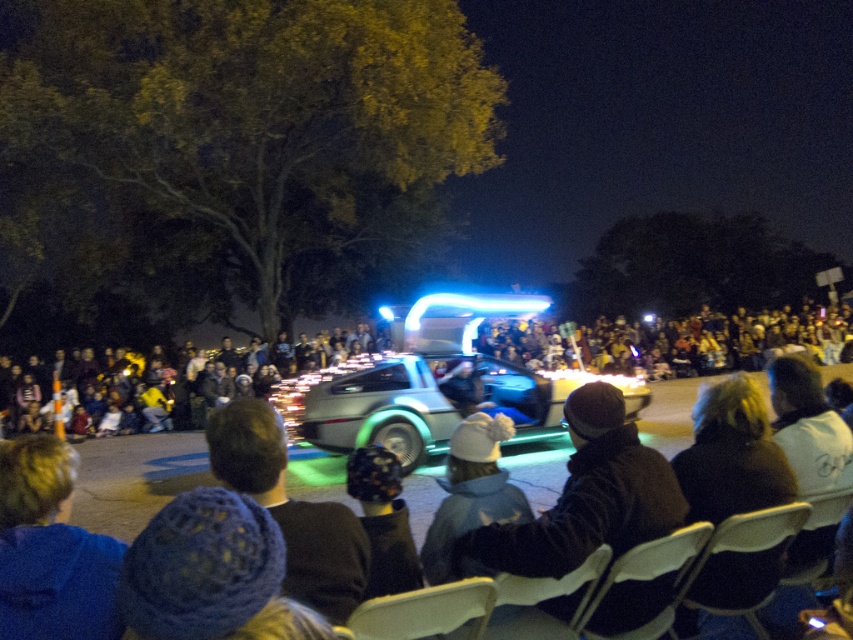
Between white cotton shirt at lower right and knitted wool hat at center, which one has less height?

→ knitted wool hat at center

Is point (788, 404) closer to camera compared to point (373, 573)?

No, (788, 404) is further to viewer.

The width and height of the screenshot is (853, 640). I want to click on white cotton shirt at lower right, so click(808, 426).

Consider the image. Which is below, dark knit hat at center or knitted wool hat at center?

Positioned lower is dark knit hat at center.

Locate an element on the screen. This screenshot has height=640, width=853. dark knit hat at center is located at coordinates (585, 497).

Is the position of silver metallic delorean at center more distant than that of white knit hat at center?

Yes.

Does silver metallic delorean at center appear on the left side of white knit hat at center?

Correct, you'll find silver metallic delorean at center to the left of white knit hat at center.

Which is in front, point (521, 433) or point (506, 518)?

Point (506, 518)

What are the coordinates of `silver metallic delorean at center` in the screenshot? It's located at (430, 401).